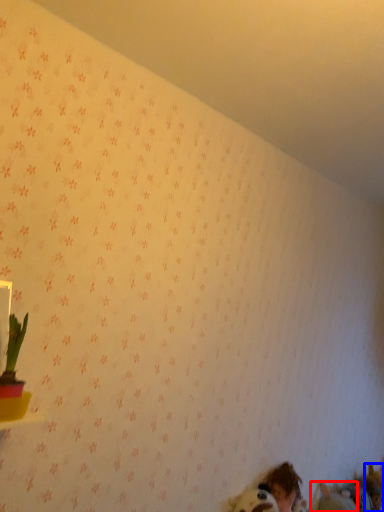
Question: Which point is closer to the camera, animal (highlighted by a red box) or animal (highlighted by a blue box)?

Choices:
 (A) animal
 (B) animal

Answer: (A)